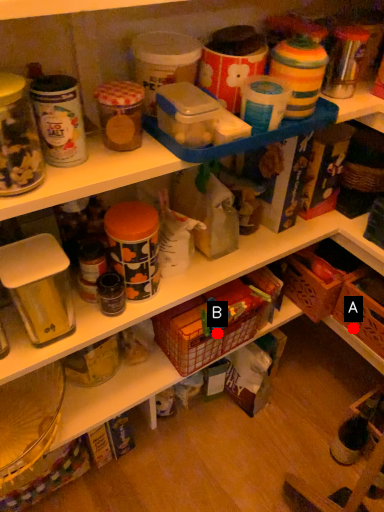
Question: Two points are circled on the image, labeled by A and B beside each circle. Among these points, which one is farthest from the camera?

Choices:
 (A) A is further
 (B) B is further

Answer: (A)